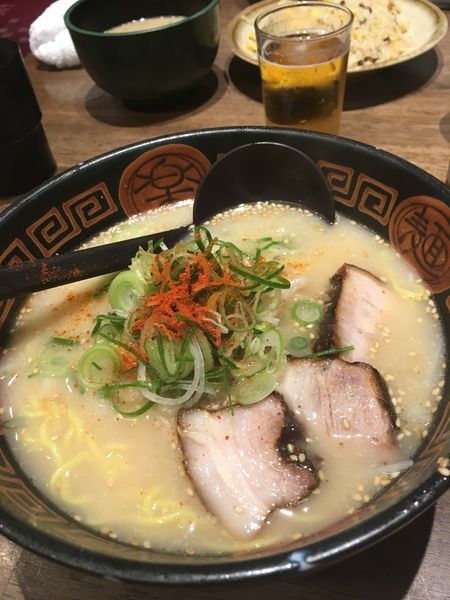
Image resolution: width=450 pixels, height=600 pixels. I want to click on plate of rice, so click(376, 45).